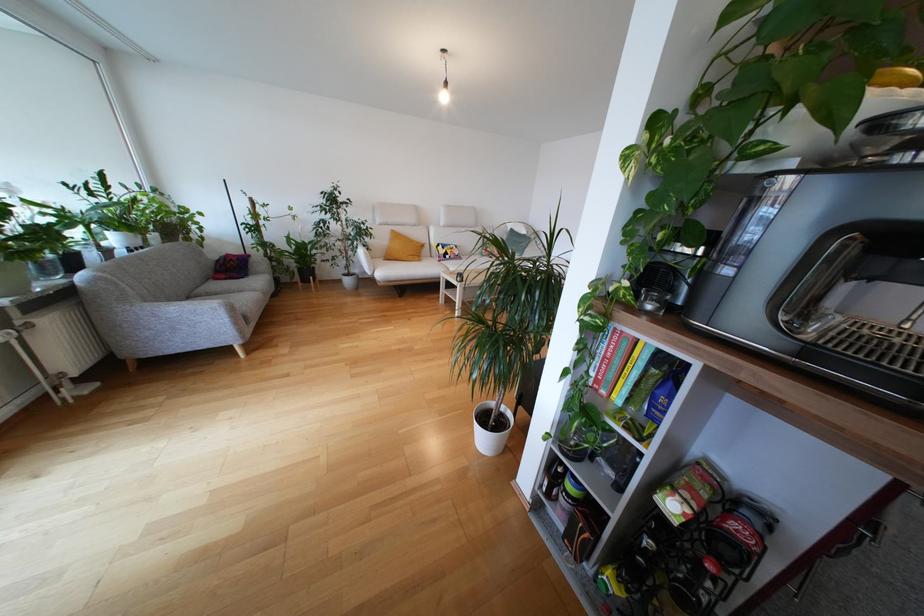
Find where to lift the white plant pot. Please return your answer as a coordinate pair (x, y).

(491, 428)